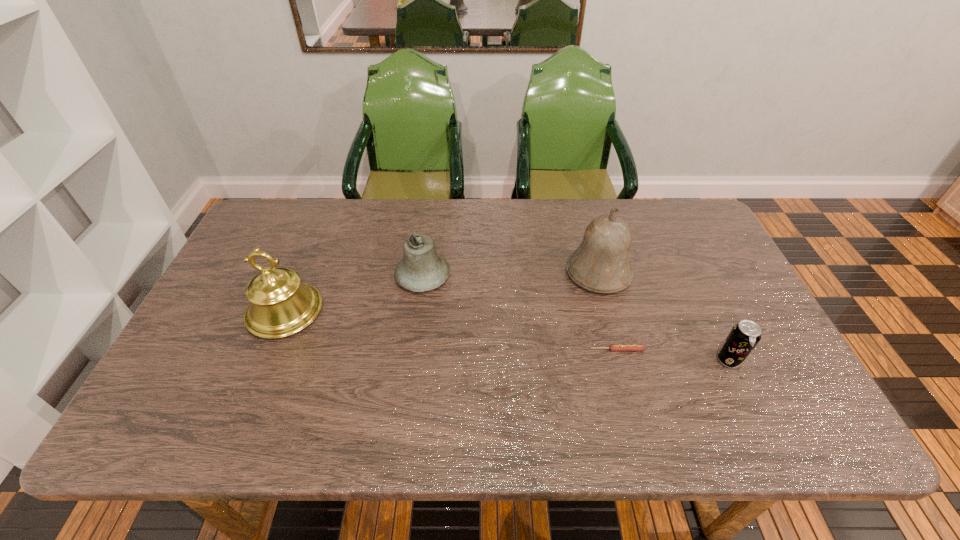
Find the location of a particular element. The height and width of the screenshot is (540, 960). free location at the near right corner of the desktop is located at coordinates (779, 433).

Find the location of `vacant region between the fourth tallest object and the rightmost bell`. vacant region between the fourth tallest object and the rightmost bell is located at coordinates click(x=663, y=316).

Find the location of a particular element. blank region between the leftmost object and the rightmost object is located at coordinates (507, 336).

Identify the location of free space between the leftmost object and the rightmost bell. (442, 292).

The height and width of the screenshot is (540, 960). I want to click on free spot between the second object from left to right and the leftmost object, so click(354, 294).

Where is `vacant space in between the leftmost object and the sausage`? vacant space in between the leftmost object and the sausage is located at coordinates pos(451,330).

Locate an element on the screen. The image size is (960, 540). vacant space in between the rightmost bell and the leftmost bell is located at coordinates (442, 292).

Where is `free space between the leftmost object and the shortest object`? free space between the leftmost object and the shortest object is located at coordinates (451, 330).

The image size is (960, 540). Find the location of `free spot between the shortest object and the rightmost object`. free spot between the shortest object and the rightmost object is located at coordinates (673, 355).

In order to click on empty location between the sausage and the rightmost bell in this screenshot , I will do `click(608, 312)`.